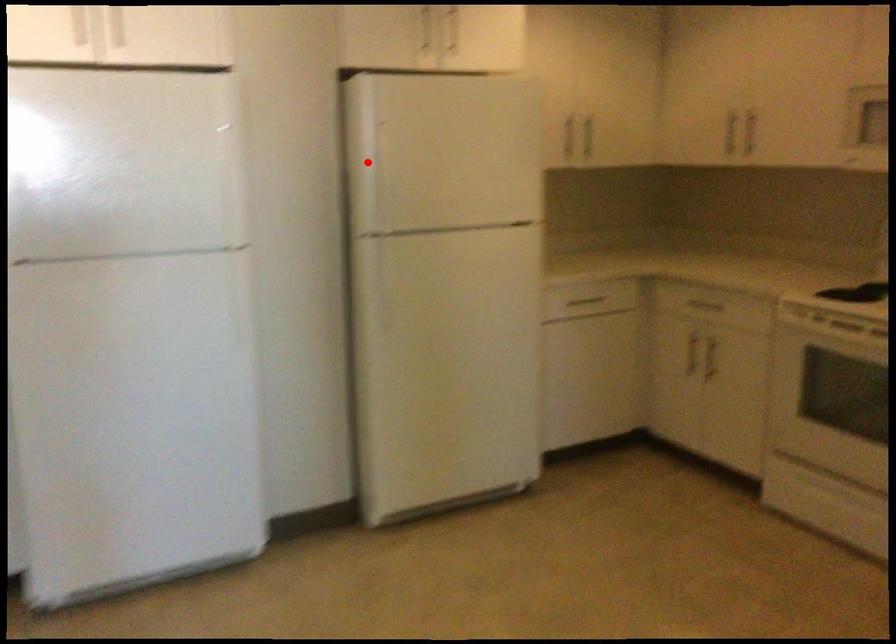
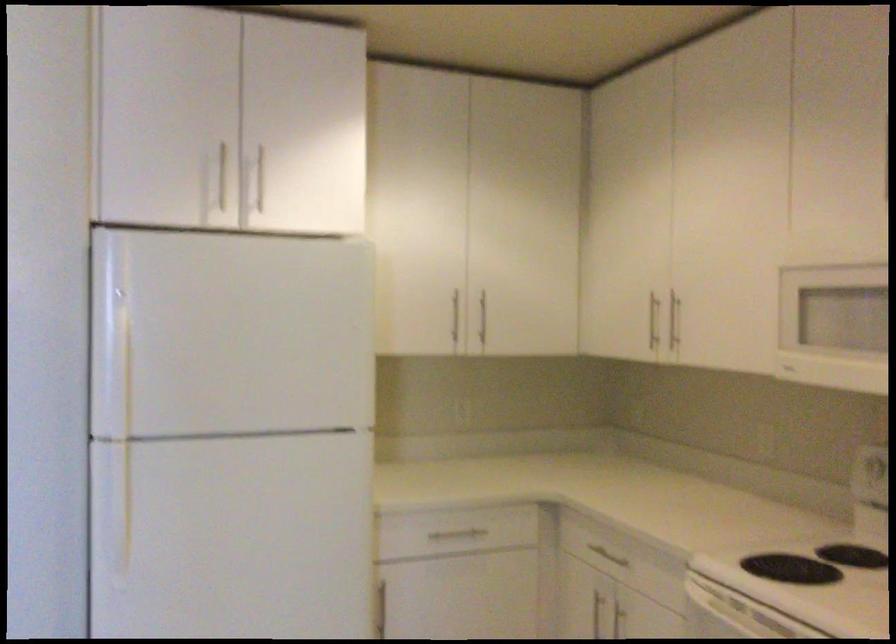
Question: I am providing you with two images of the same scene from different viewpoints. In image1, a red point is highlighted. Considering the same 3D point in image2, which of the following is correct?

Choices:
 (A) It is closer
 (B) It is farther

Answer: (A)